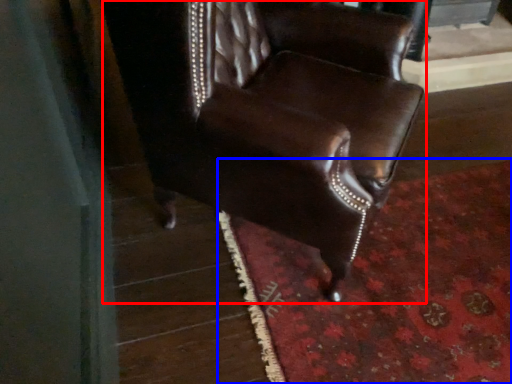
Question: Which object is closer to the camera taking this photo, chair (highlighted by a red box) or mat (highlighted by a blue box)?

Choices:
 (A) chair
 (B) mat

Answer: (A)